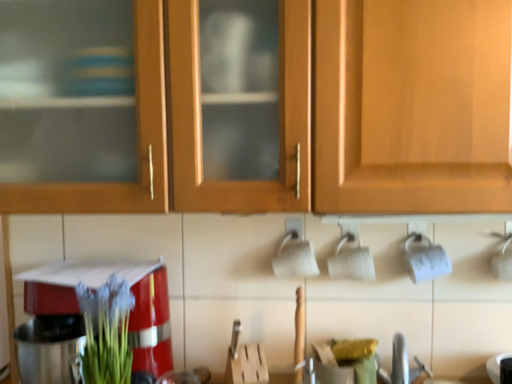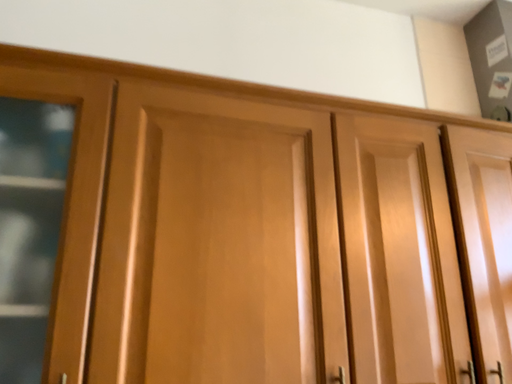
Question: How did the camera likely rotate when shooting the video?

Choices:
 (A) rotated left
 (B) rotated right

Answer: (B)